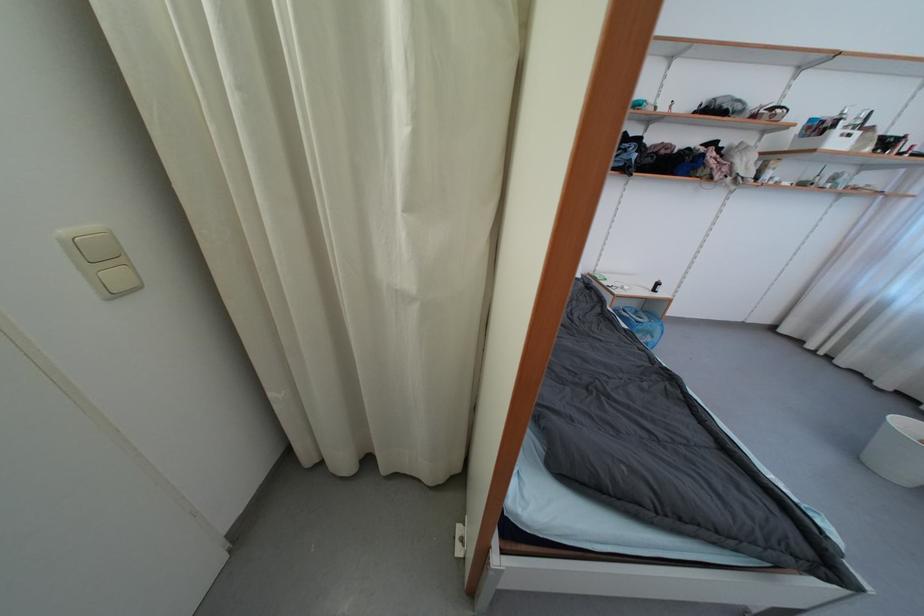
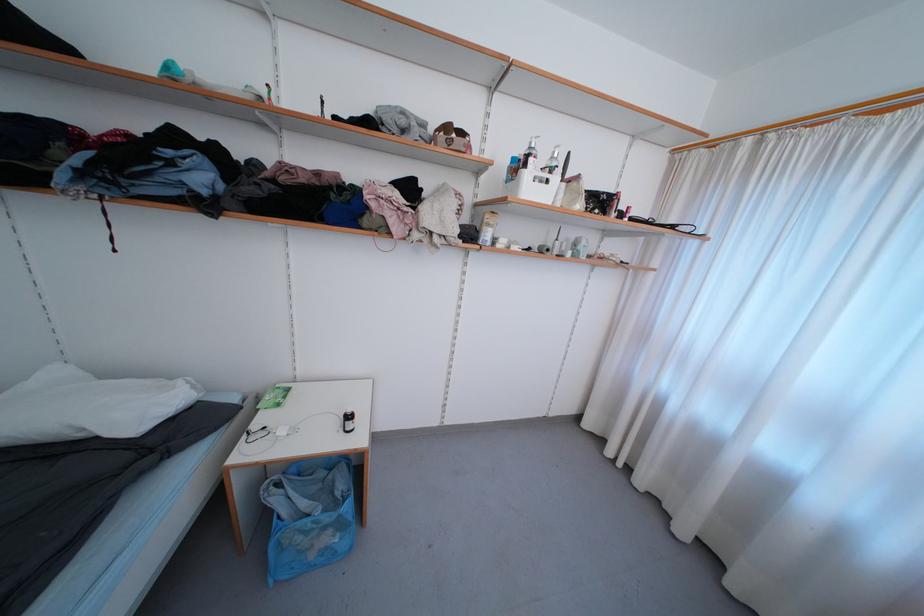
Locate, in the second image, the point that corresponds to the point at 663,291 in the first image.

(354, 429)